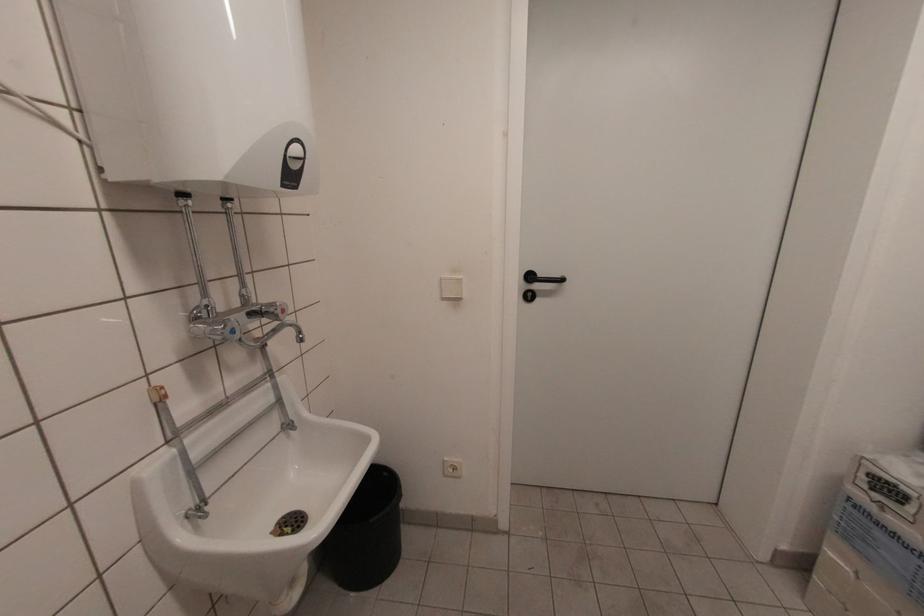
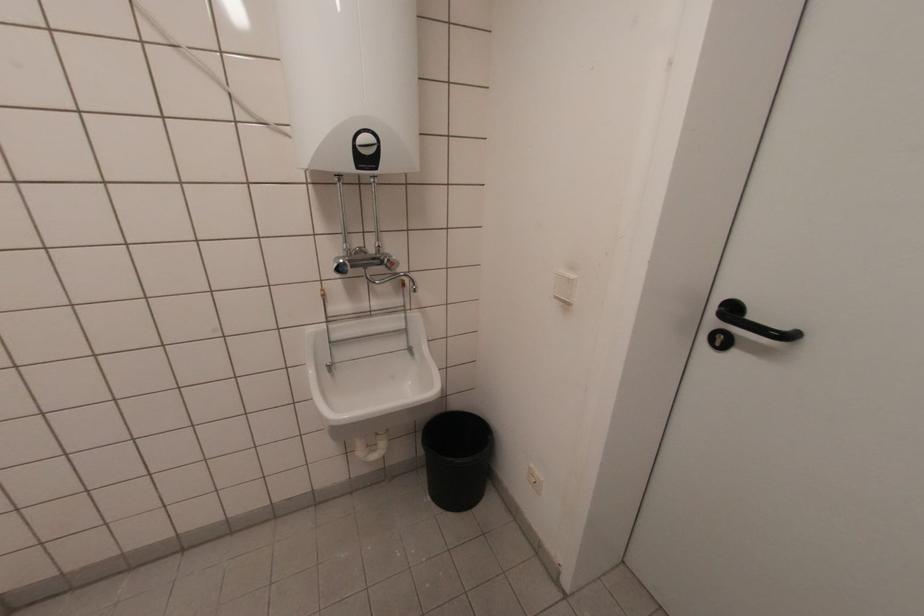
In the second image, find the point that corresponds to point 530,299 in the first image.

(719, 344)